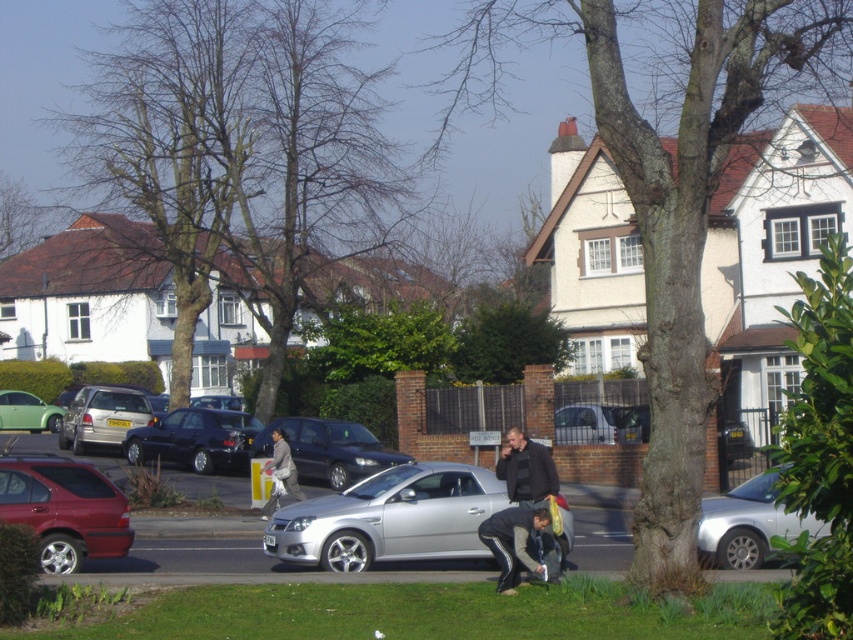
You are standing at point (x=102, y=417) in the image. What object is located exactly at this point?

The silver metallic hatchback at center left is located exactly at point (x=102, y=417).

You are standing at the point marked by coordinates point [601,422]. Looking around, you see a silver metallic van at center. What object is located at your current position?

The point [601,422] marks the location of the silver metallic van at center.

You are standing at the point labeled as point (514, 541) in the image. Looking around, you see a silver car parked on the curb and a man near a tree trunk. Which direction should you walk to reach the silver car parked along the curb?

The point (514, 541) is located on the dark gray fabric jacket at lower center. Since the silver car is parked along the curb in the middle ground, you should walk towards the silver car parked along the curb to reach it.